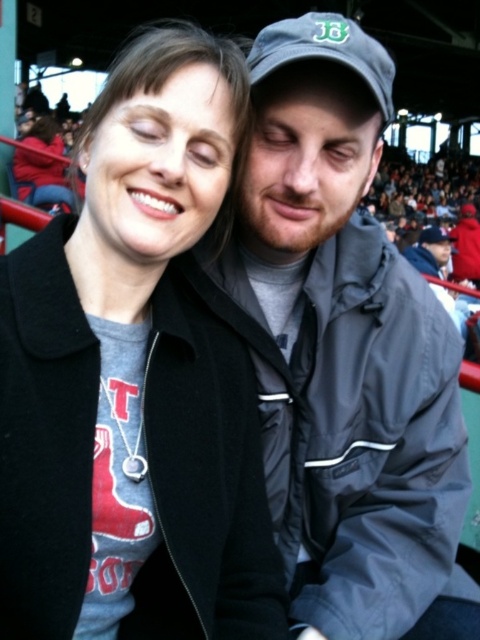
Question: Is gray matte jacket at center positioned behind matte gray sweatshirt at upper left?

Choices:
 (A) no
 (B) yes

Answer: (A)

Question: Which is farther from the matte gray sweatshirt at upper left?

Choices:
 (A) gray fabric jacket at center
 (B) gray matte jacket at center

Answer: (A)

Question: Can you confirm if gray fabric jacket at center is positioned to the left of matte gray sweatshirt at upper left?

Choices:
 (A) yes
 (B) no

Answer: (B)

Question: Which of the following is the farthest from the observer?

Choices:
 (A) (440, 528)
 (B) (224, 323)

Answer: (B)

Question: In this image, where is gray matte jacket at center located relative to gray fabric jacket at center?

Choices:
 (A) above
 (B) below

Answer: (A)

Question: Which object appears closest to the camera in this image?

Choices:
 (A) gray matte jacket at center
 (B) matte gray sweatshirt at upper left

Answer: (A)